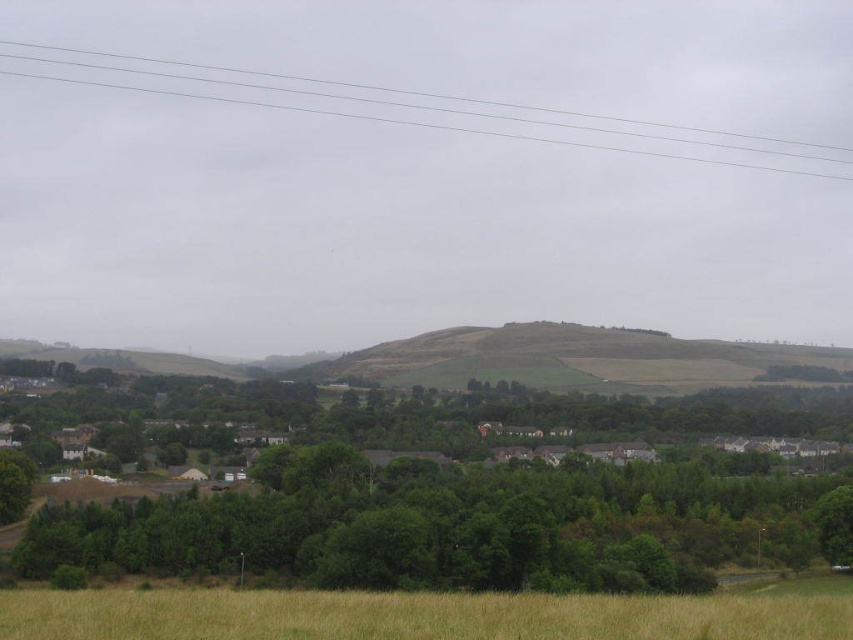
You are standing in the field of golden grass and want to take a photo of the green leafy tree at lower center and the clear plastic power lines at upper center. Which object should you focus on first to ensure both are in focus?

The green leafy tree at lower center is closer to the viewer than the clear plastic power lines at upper center. To ensure both are in focus, you should focus on the green leafy tree at lower center first because it is closer, allowing the power lines to fall within the depth of field range.

You are a drone operator flying a drone that has a maximum flight distance of 100 meters. You are instructed to fly the drone from your current position to capture an aerial view of the green leafy tree at lower center. Can the drone reach the tree without exceeding its maximum flight distance?

The distance of green leafy tree at lower center from camera is 80.56 meters, so the drone can safely reach the tree as it is within the 100 meters maximum flight distance.